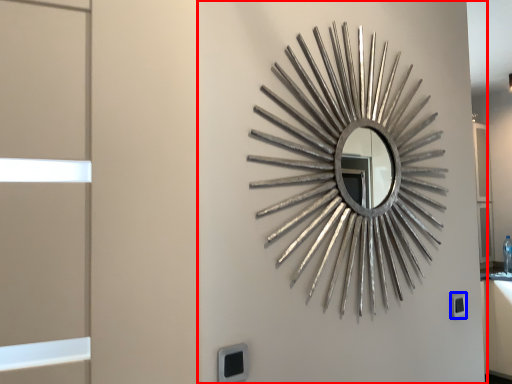
Question: Which of the following is the farthest to the observer, backdrop (highlighted by a red box) or electric outlet (highlighted by a blue box)?

Choices:
 (A) backdrop
 (B) electric outlet

Answer: (B)